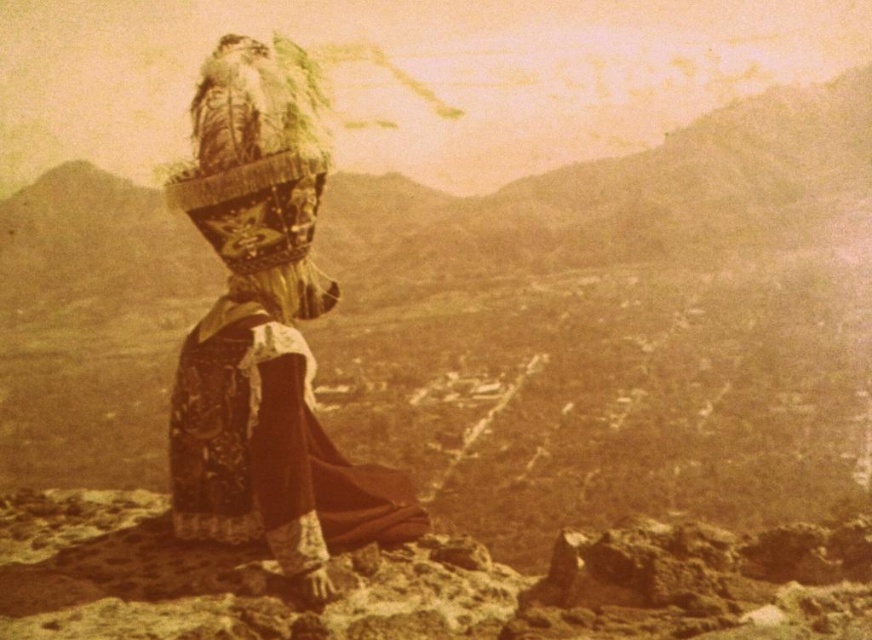
You are a fashion designer observing the traditional attire of the person in the image. You need to determine which item is taller between the matte brown dress at center and the fuzzy fur headdress at center. Which one is taller?

The matte brown dress at center has a greater height compared to the fuzzy fur headdress at center, so the matte brown dress at center is taller.

You are a photographer trying to capture the person in the velvet maroon dress at center and the fuzzy fur headdress at center. Which object should you focus on first if you want to start from the top of the image?

The fuzzy fur headdress at center should be focused on first because it is located above the velvet maroon dress at center.

You are a photographer positioned at the camera location. You want to capture a closeup shot of the matte brown dress at center. Considering your current distance, can you achieve this without moving closer?

The matte brown dress at center is 3.48 meters away from the camera. To capture a closeup shot without moving closer, you would need a telephoto lens capable of zooming in effectively from that distance.